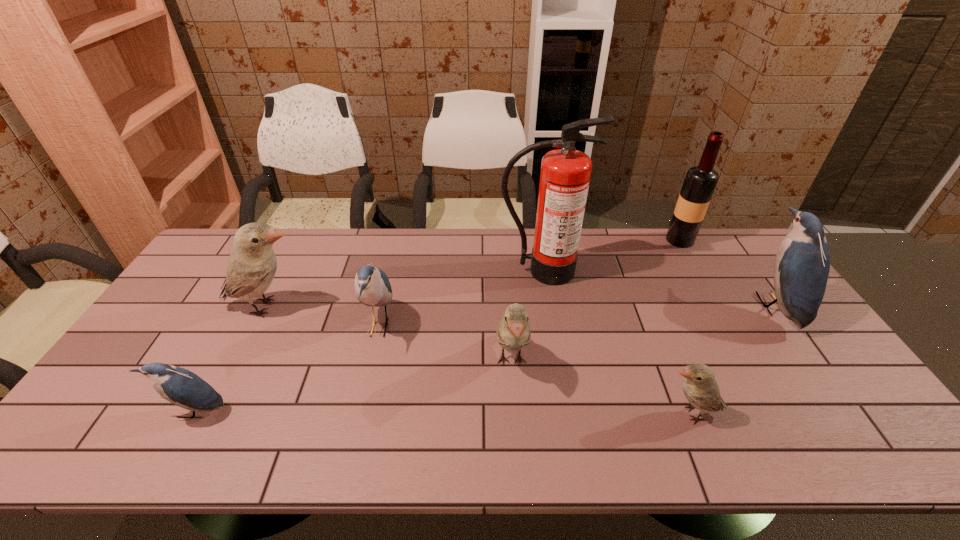
Image resolution: width=960 pixels, height=540 pixels. Find the location of `the second white bird from left to right`. the second white bird from left to right is located at coordinates (513, 332).

What are the coordinates of `the second biggest white bird` in the screenshot? It's located at (513, 332).

Where is `the nearest blue bird`? the nearest blue bird is located at coordinates (185, 389).

This screenshot has height=540, width=960. I want to click on the leftmost blue bird, so click(x=185, y=389).

At what (x,y) coordinates should I click in order to perform the action: click on the smallest white bird. Please return your answer as a coordinate pair (x, y). The image size is (960, 540). Looking at the image, I should click on (701, 389).

The image size is (960, 540). What are the coordinates of `the rightmost white bird` in the screenshot? It's located at (701, 389).

The image size is (960, 540). I want to click on vacant space located on the front-facing side of the tallest object, so click(555, 358).

Find the location of a particular element. This screenshot has height=540, width=960. vacant space situated on the right of the second tallest object is located at coordinates (718, 240).

The image size is (960, 540). In order to click on blank space located 0.230m at the tip of the rightmost bird's beak in this screenshot , I will do `click(679, 305)`.

Locate an element on the screen. vacant area situated at the tip of the rightmost bird's beak is located at coordinates (676, 305).